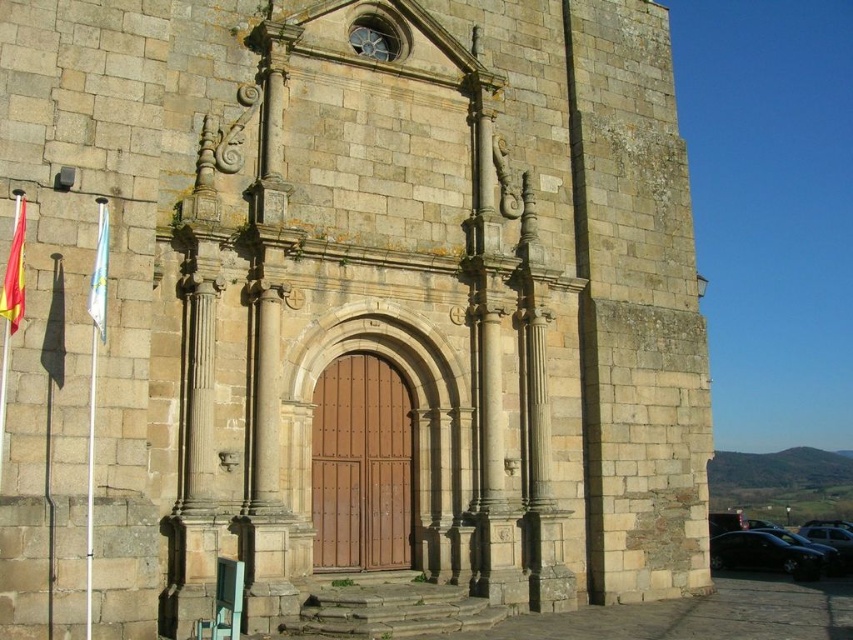
Question: Considering the real-world distances, which object is farthest from the red fabric flag at left?

Choices:
 (A) white fabric flag at left
 (B) shiny black car at lower right

Answer: (B)

Question: Is red fabric flag at left to the right of white fabric flag at left from the viewer's perspective?

Choices:
 (A) yes
 (B) no

Answer: (B)

Question: Which object is closer to the camera taking this photo?

Choices:
 (A) red fabric flag at left
 (B) shiny black car at lower right
 (C) white fabric flag at left

Answer: (A)

Question: Is the position of red fabric flag at left more distant than that of white fabric flag at left?

Choices:
 (A) yes
 (B) no

Answer: (B)

Question: Which is farther from the red fabric flag at left?

Choices:
 (A) shiny black car at lower right
 (B) white fabric flag at left

Answer: (A)

Question: Where is shiny black car at lower right located in relation to white fabric flag at left in the image?

Choices:
 (A) below
 (B) above

Answer: (A)